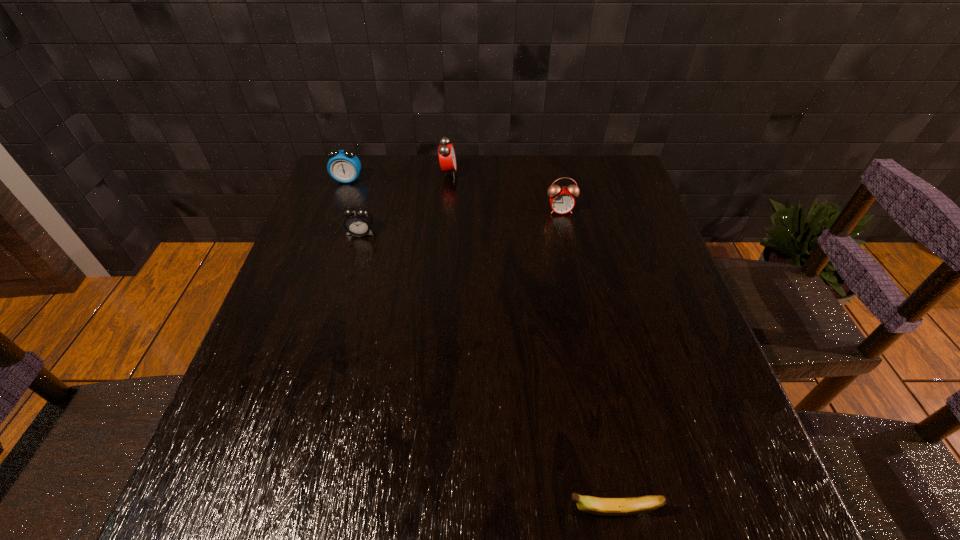
Where is `free space at the far left corner`? Image resolution: width=960 pixels, height=540 pixels. free space at the far left corner is located at coordinates (323, 195).

The image size is (960, 540). Find the location of `vacant area at the far right corner`. vacant area at the far right corner is located at coordinates (616, 166).

Identify the location of free space at the near right corner of the desktop. The width and height of the screenshot is (960, 540). (684, 469).

Locate an element on the screen. This screenshot has height=540, width=960. free space between the shortest alarm clock and the rightmost alarm clock is located at coordinates (461, 222).

Locate an element on the screen. blank region between the leftmost object and the shortest alarm clock is located at coordinates (354, 206).

I want to click on free spot between the nearest object and the third alarm clock from left to right, so click(530, 342).

At what (x,y) coordinates should I click in order to perform the action: click on free spot between the second alarm clock from right to left and the third farthest object. Please return your answer as a coordinate pair (x, y). This screenshot has width=960, height=540. Looking at the image, I should click on [x=505, y=192].

At what (x,y) coordinates should I click in order to perform the action: click on vacant area between the leftmost alarm clock and the nearest object. Please return your answer as a coordinate pair (x, y). The image size is (960, 540). Looking at the image, I should click on (479, 346).

This screenshot has height=540, width=960. Identify the location of free space between the rightmost alarm clock and the nearest object. (586, 361).

Where is `vacant space that is in between the third farthest alarm clock and the nearest object`? The width and height of the screenshot is (960, 540). vacant space that is in between the third farthest alarm clock and the nearest object is located at coordinates (586, 361).